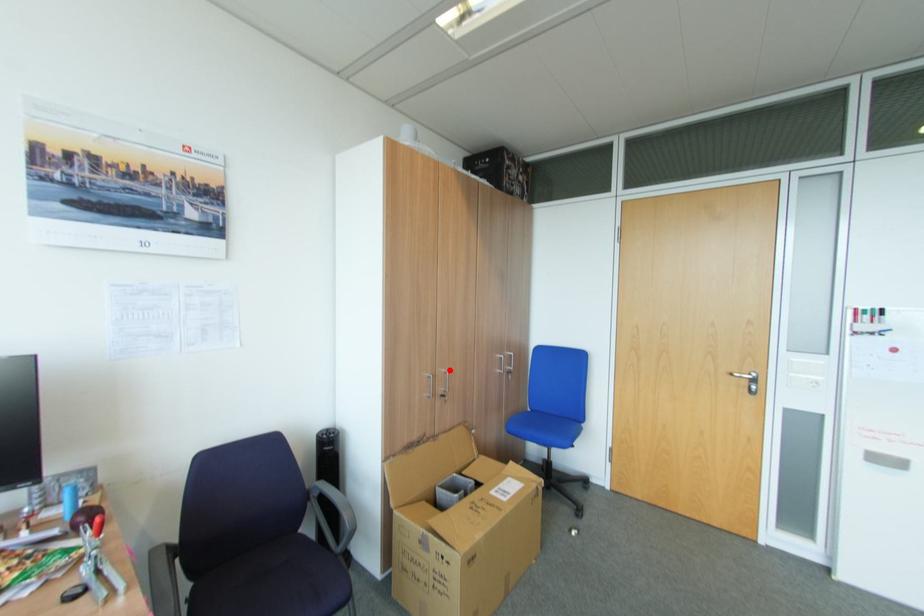
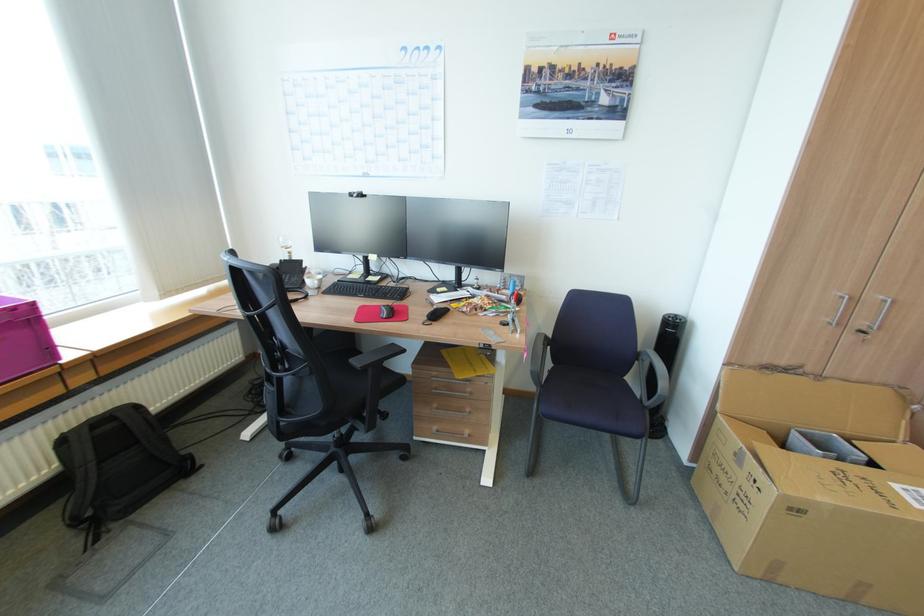
The point at the highlighted location is marked in the first image. Where is the corresponding point in the second image?

(888, 297)